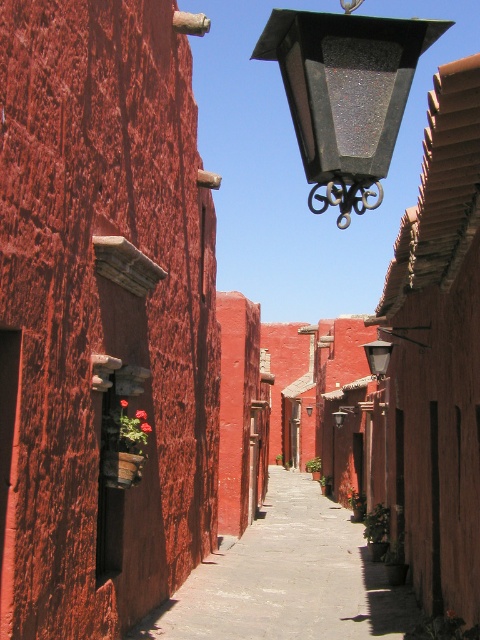
Is smooth concrete pavement at center in front of black textured lantern at upper center?

No, it is behind black textured lantern at upper center.

The height and width of the screenshot is (640, 480). What do you see at coordinates (288, 579) in the screenshot? I see `smooth concrete pavement at center` at bounding box center [288, 579].

Find the location of a particular element. The height and width of the screenshot is (640, 480). smooth concrete pavement at center is located at coordinates (288, 579).